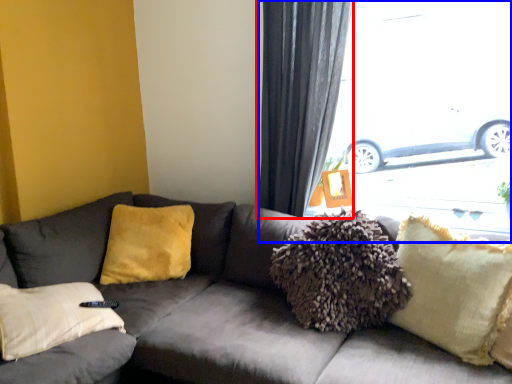
Question: Among these objects, which one is nearest to the camera, curtain (highlighted by a red box) or window (highlighted by a blue box)?

Choices:
 (A) curtain
 (B) window

Answer: (A)